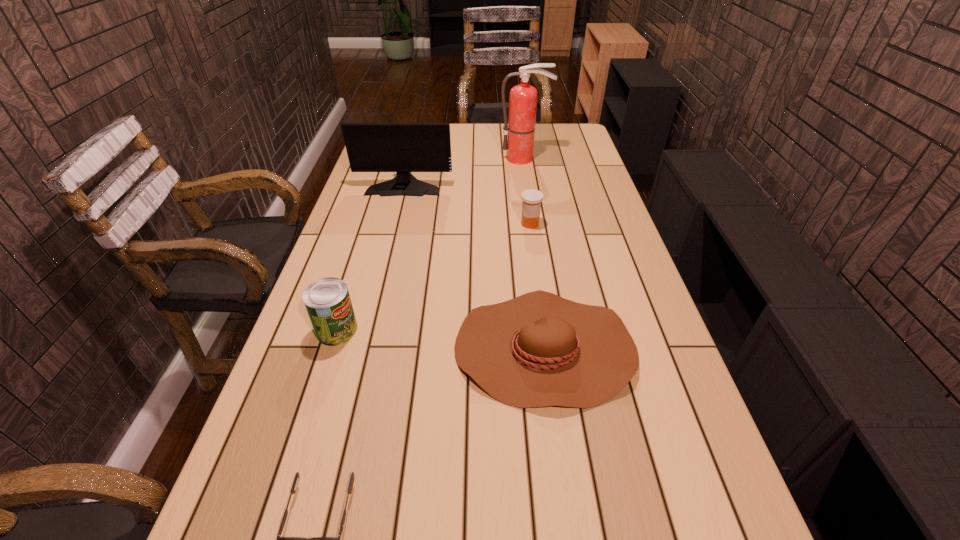
You are a GUI agent. You are given a task and a screenshot of the screen. Output one action in this format:
    pyautogui.click(x=<x>, y=<y>)
    Task: Click on the tallest object
    Image resolution: width=960 pixels, height=540 pixels.
    Given the screenshot: What is the action you would take?
    pyautogui.click(x=520, y=128)

Identify the location of fire extinguisher. (520, 128).

Find the location of a particular element. Image resolution: width=960 pixels, height=540 pixels. monitor is located at coordinates (371, 147).

Locate an element on the screen. This screenshot has width=960, height=540. the second tallest object is located at coordinates (371, 147).

Locate an element on the screen. the third tallest object is located at coordinates (327, 300).

Locate an element on the screen. The width and height of the screenshot is (960, 540). medicine is located at coordinates (531, 199).

At what (x,y) coordinates should I click in order to perform the action: click on the third farthest object. Please return your answer as a coordinate pair (x, y). Looking at the image, I should click on (531, 199).

Locate an element on the screen. The width and height of the screenshot is (960, 540). the fifth tallest object is located at coordinates (537, 350).

The image size is (960, 540). In order to click on vacant space situated 0.400m with the handle and hose on the farthest object in this screenshot , I will do `click(534, 222)`.

Locate an element on the screen. vacant space located on the screen side of the monitor is located at coordinates (396, 217).